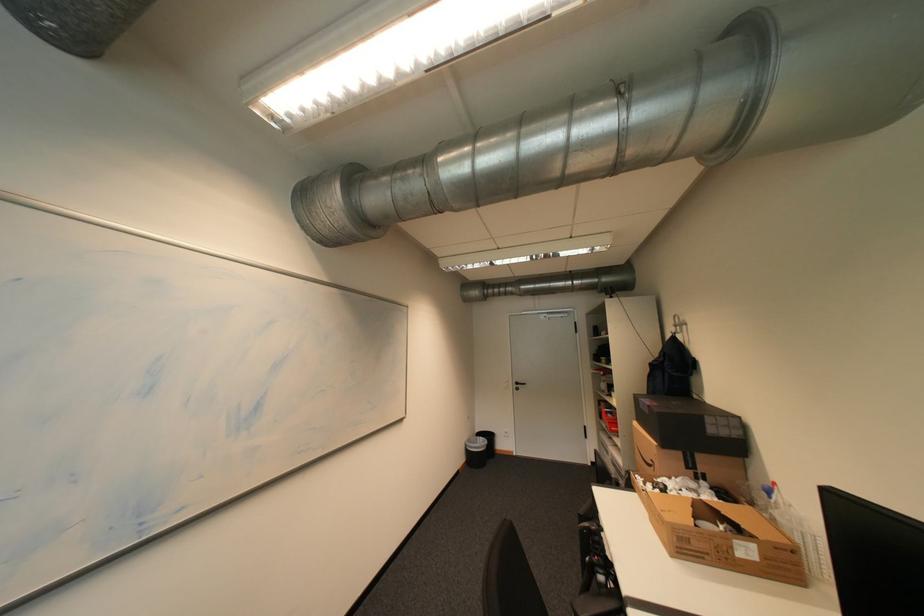
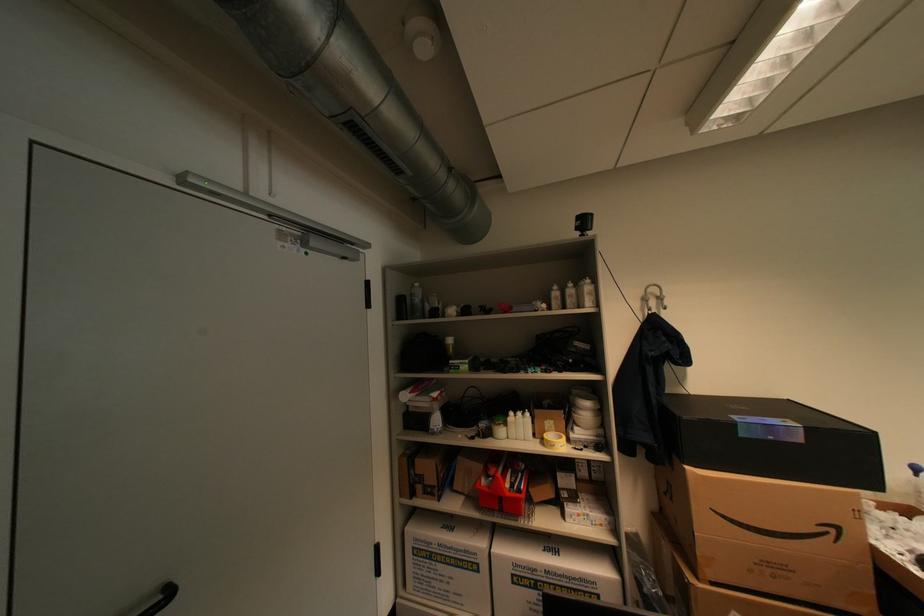
The point at (662, 464) is marked in the first image. Where is the corresponding point in the second image?

(841, 531)